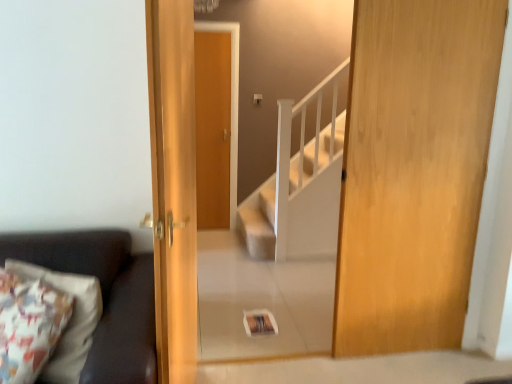
Question: Does dark brown leather couch at left have a greater width compared to wooden door at right, which is counted as the second door, starting from the left?

Choices:
 (A) yes
 (B) no

Answer: (A)

Question: Could you tell me if dark brown leather couch at left is turned towards wooden door at right, which is counted as the second door, starting from the left?

Choices:
 (A) yes
 (B) no

Answer: (B)

Question: From a real-world perspective, is dark brown leather couch at left physically below wooden door at right, positioned as the first door in right-to-left order?

Choices:
 (A) no
 (B) yes

Answer: (B)

Question: Can you confirm if dark brown leather couch at left is thinner than wooden door at right, which is counted as the second door, starting from the left?

Choices:
 (A) no
 (B) yes

Answer: (A)

Question: Are dark brown leather couch at left and wooden door at right, which is counted as the second door, starting from the left, located far from each other?

Choices:
 (A) no
 (B) yes

Answer: (B)

Question: Choose the correct answer: Is dark brown leather couch at left inside wooden door at center, which is the first door from left to right, or outside it?

Choices:
 (A) inside
 (B) outside

Answer: (B)

Question: From their relative heights in the image, would you say dark brown leather couch at left is taller or shorter than wooden door at center, which is the first door from left to right?

Choices:
 (A) tall
 (B) short

Answer: (B)

Question: Would you say dark brown leather couch at left is to the left or to the right of wooden door at center, which is the first door from left to right, in the picture?

Choices:
 (A) left
 (B) right

Answer: (A)

Question: Is dark brown leather couch at left bigger or smaller than wooden door at center, acting as the 2th door starting from the right?

Choices:
 (A) small
 (B) big

Answer: (B)

Question: Would you say dark brown leather couch at left is inside or outside wooden door at right, positioned as the first door in right-to-left order?

Choices:
 (A) outside
 (B) inside

Answer: (A)

Question: Looking at the image, does dark brown leather couch at left seem bigger or smaller compared to wooden door at right, which is counted as the second door, starting from the left?

Choices:
 (A) small
 (B) big

Answer: (B)

Question: In the image, is dark brown leather couch at left on the left side or the right side of wooden door at right, which is counted as the second door, starting from the left?

Choices:
 (A) left
 (B) right

Answer: (A)

Question: Is dark brown leather couch at left wider or thinner than wooden door at right, which is counted as the second door, starting from the left?

Choices:
 (A) thin
 (B) wide

Answer: (B)

Question: From a real-world perspective, is wooden door at right, positioned as the first door in right-to-left order, above or below wooden door at center, acting as the 2th door starting from the right?

Choices:
 (A) above
 (B) below

Answer: (A)

Question: From their relative heights in the image, would you say wooden door at right, which is counted as the second door, starting from the left, is taller or shorter than wooden door at center, acting as the 2th door starting from the right?

Choices:
 (A) tall
 (B) short

Answer: (A)